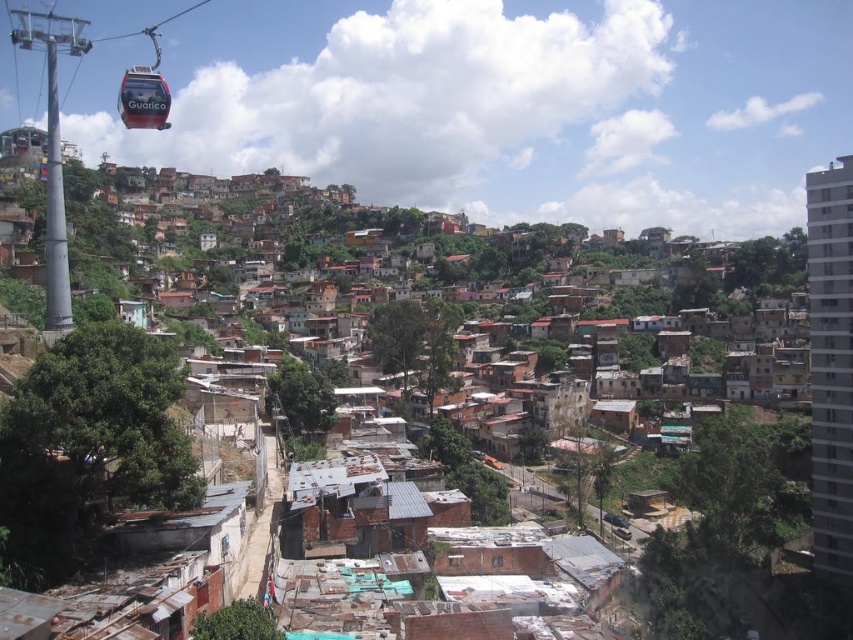
Can you confirm if brown corrugated metal rooftops at center is positioned to the left of red glossy cable car at upper left?

Incorrect, brown corrugated metal rooftops at center is not on the left side of red glossy cable car at upper left.

Between brown corrugated metal rooftops at center and red glossy cable car at upper left, which one appears on the right side from the viewer's perspective?

brown corrugated metal rooftops at center

Which is behind, point (309, 221) or point (142, 77)?

The point (309, 221) is more distant.

The image size is (853, 640). I want to click on brown corrugated metal rooftops at center, so click(80, 452).